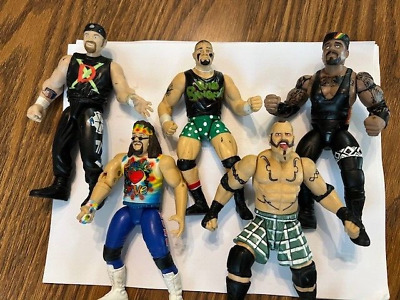
Locate an element on the screen. action figure toys is located at coordinates (84, 120), (149, 194), (191, 96), (278, 174), (325, 108).